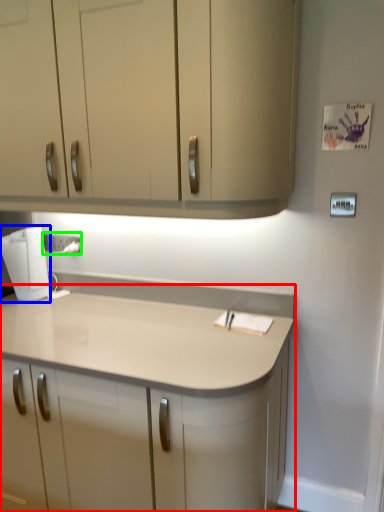
Question: Which object is the closest to the countertop (highlighted by a red box)? Choose among these: home appliance (highlighted by a blue box) or electric outlet (highlighted by a green box).

Choices:
 (A) home appliance
 (B) electric outlet

Answer: (A)